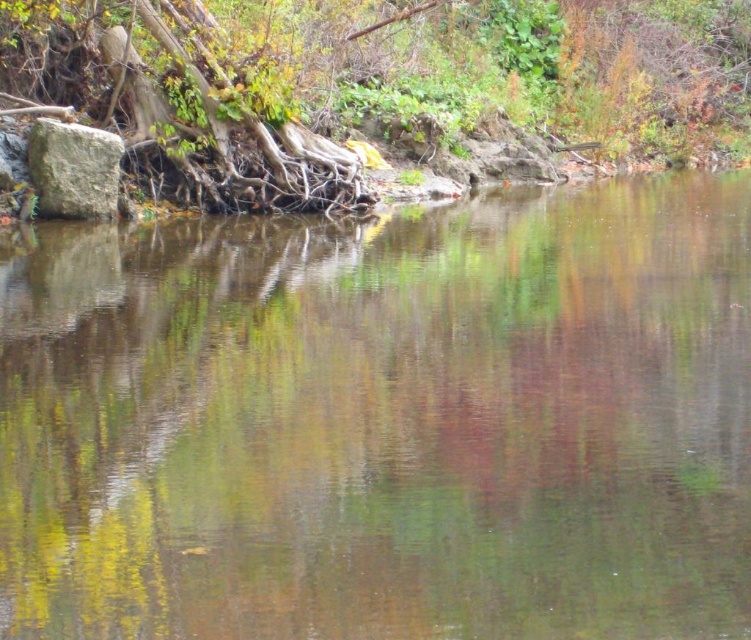
Can you confirm if transparent water at center is thinner than gray rough stone at left?

No.

Does transparent water at center have a greater height compared to gray rough stone at left?

Indeed, transparent water at center has a greater height compared to gray rough stone at left.

Find the location of a particular element. Image resolution: width=751 pixels, height=640 pixels. transparent water at center is located at coordinates (385, 422).

You are a GUI agent. You are given a task and a screenshot of the screen. Output one action in this format:
    pyautogui.click(x=<x>, y=<y>)
    Task: Click on the transparent water at center
    This screenshot has height=640, width=751.
    Given the screenshot: What is the action you would take?
    pyautogui.click(x=385, y=422)

From the picture: How far apart are transparent water at center and smooth brown tree roots at left?

They are 11.67 meters apart.

Can you confirm if transparent water at center is positioned to the right of smooth brown tree roots at left?

Indeed, transparent water at center is positioned on the right side of smooth brown tree roots at left.

Measure the distance between transparent water at center and camera.

transparent water at center and camera are 6.88 meters apart.

Locate an element on the screen. transparent water at center is located at coordinates (385, 422).

Is smooth brown tree roots at left thinner than gray rough stone at left?

Correct, smooth brown tree roots at left's width is less than gray rough stone at left's.

Can you confirm if smooth brown tree roots at left is wider than gray rough stone at left?

Incorrect, smooth brown tree roots at left's width does not surpass gray rough stone at left's.

Is point (14, 6) positioned after point (83, 211)?

That is False.

What are the coordinates of `smooth brown tree roots at left` in the screenshot? It's located at (176, 104).